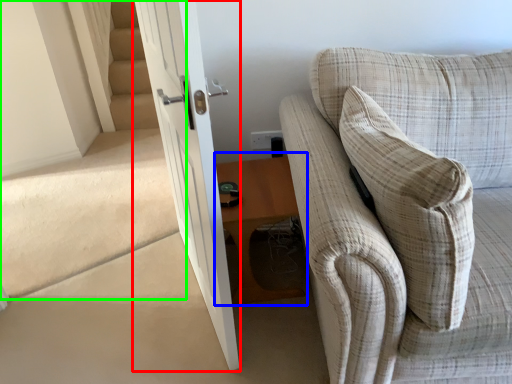
Question: Considering the real-world distances, which object is closest to door (highlighted by a red box)? table (highlighted by a blue box) or stairwell (highlighted by a green box).

Choices:
 (A) table
 (B) stairwell

Answer: (A)